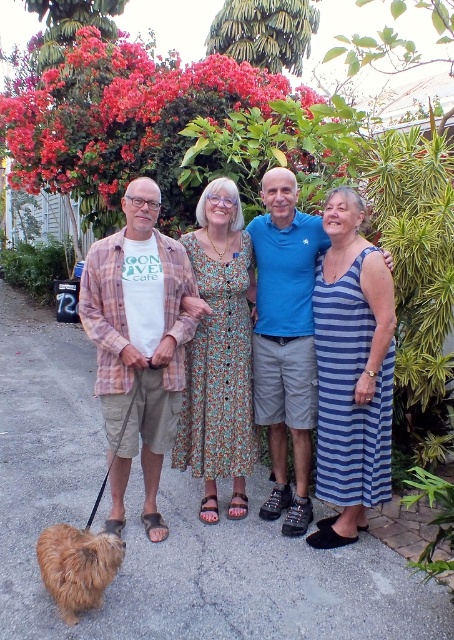
Based on the scene description, which object is taller between the matte cotton shirt at left and the shaggy brown fur at lower left?

The matte cotton shirt at left is taller than the shaggy brown fur at lower left according to the description.

Where is the matte cotton shirt at left located in the image?

The matte cotton shirt at left is located at point (x=133, y=330) in the image.